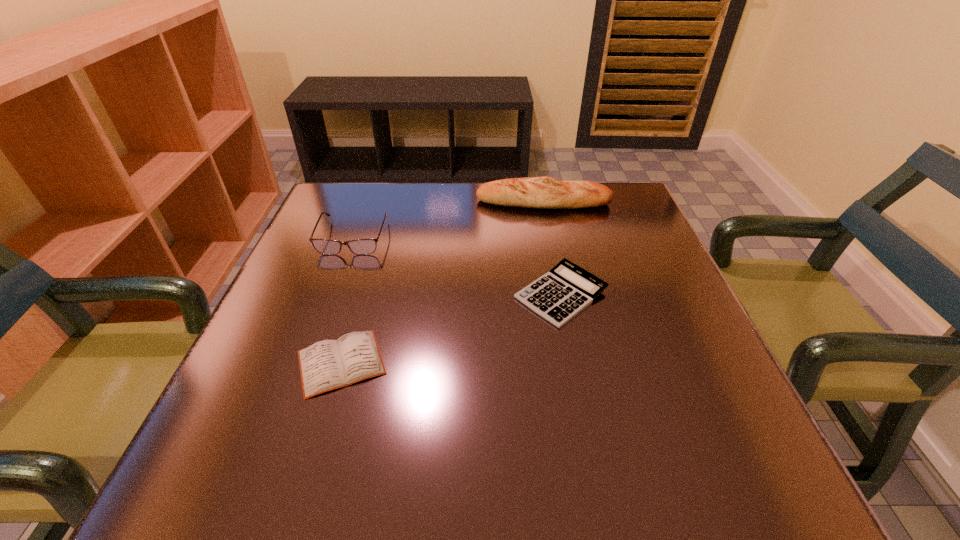
The width and height of the screenshot is (960, 540). Find the location of `vacant space at the far edge of the desktop`. vacant space at the far edge of the desktop is located at coordinates (404, 204).

At what (x,y) coordinates should I click in order to perform the action: click on blank space at the near edge of the desktop. Please return your answer as a coordinate pair (x, y). Looking at the image, I should click on (547, 454).

Identify the location of vacant position at the left edge of the desktop. This screenshot has width=960, height=540. (288, 373).

The height and width of the screenshot is (540, 960). Find the location of `vacant space at the right edge`. vacant space at the right edge is located at coordinates (652, 433).

The height and width of the screenshot is (540, 960). In order to click on vacant space at the far left corner of the desktop in this screenshot , I will do [x=328, y=225].

The width and height of the screenshot is (960, 540). In order to click on free region at the far right corner of the desktop in this screenshot , I will do `click(650, 227)`.

This screenshot has height=540, width=960. What are the coordinates of `vacant space at the near right corner` in the screenshot? It's located at (770, 454).

Identify the location of free point between the calculator and the diary. (451, 328).

Where is `free space between the shortest object and the second shortest object`? free space between the shortest object and the second shortest object is located at coordinates (451, 328).

Find the location of `vacant region between the diary and the third tallest object`. vacant region between the diary and the third tallest object is located at coordinates (451, 328).